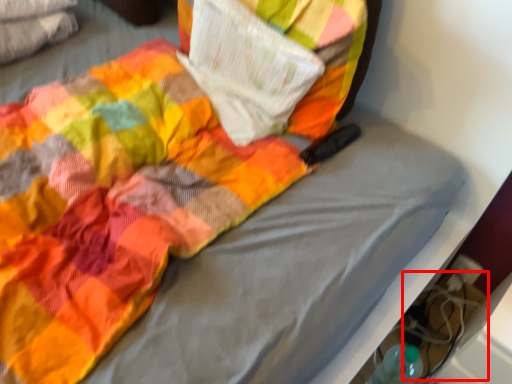
Question: In this image, where is footwear (annotated by the red box) located relative to paperback book?

Choices:
 (A) left
 (B) right

Answer: (B)